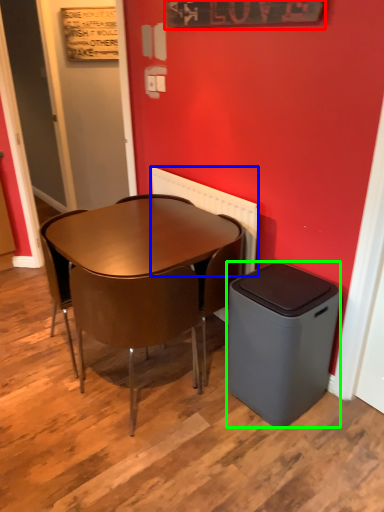
Question: Considering the real-world distances, which object is closest to bulletin board (highlighted by a red box)? radiator (highlighted by a blue box) or trash bin/can (highlighted by a green box).

Choices:
 (A) radiator
 (B) trash bin/can

Answer: (A)